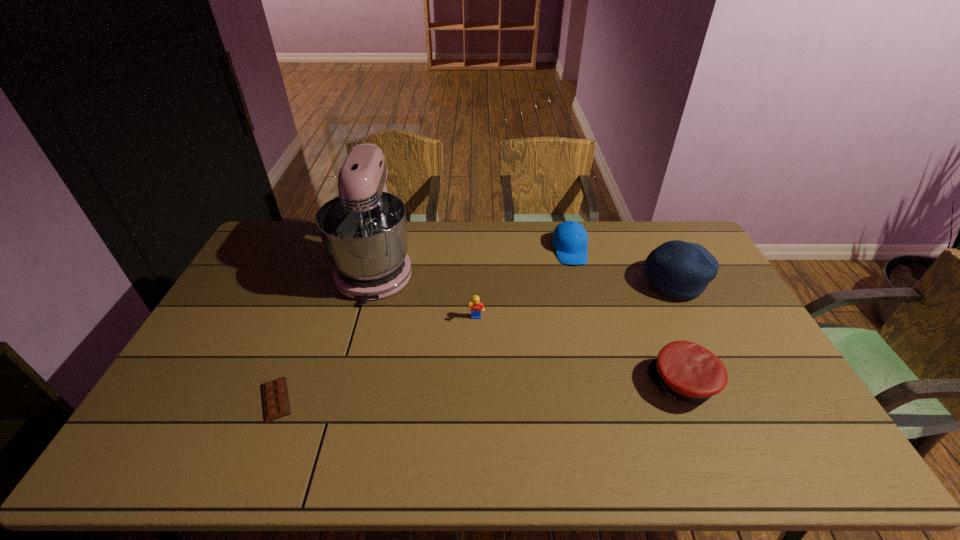
Locate an element on the screen. This screenshot has width=960, height=540. vacant space positioned 0.370m on the front-facing side of the farther cap is located at coordinates (595, 347).

The width and height of the screenshot is (960, 540). Identify the location of vacant position located on the face of the Lego. (476, 346).

I want to click on vacant space located 0.100m at the front of the right cap where the visor is located, so click(614, 383).

Identify the location of vacant position located 0.300m at the front of the right cap where the visor is located. (541, 383).

Identify the location of vacant space located at the front of the right cap where the visor is located. Image resolution: width=960 pixels, height=540 pixels. (531, 383).

Where is `vacant space situated on the back of the shortest object`? vacant space situated on the back of the shortest object is located at coordinates (292, 360).

The width and height of the screenshot is (960, 540). Find the location of `mixer that is positioned at the far edge`. mixer that is positioned at the far edge is located at coordinates (364, 233).

Find the location of a particular element. cap that is at the far edge is located at coordinates (570, 239).

Identify the location of object that is at the right edge. (681, 270).

Image resolution: width=960 pixels, height=540 pixels. In the image, there is a desktop. Identify the location of free space at the far edge. click(x=488, y=246).